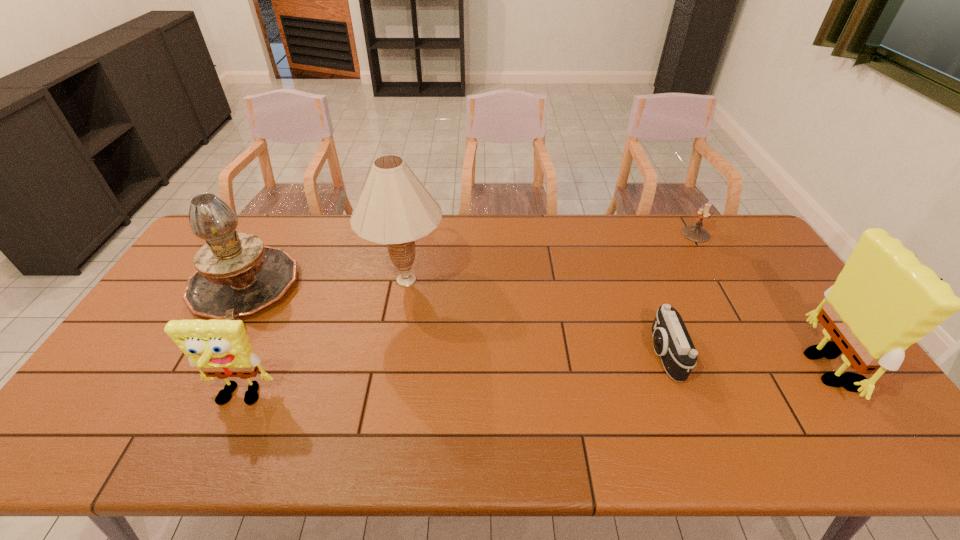
Where is `object situated at the left edge`? The image size is (960, 540). object situated at the left edge is located at coordinates (237, 275).

Where is `sponge situated at the right edge`? sponge situated at the right edge is located at coordinates (884, 300).

Where is `candle holder located in the right edge section of the desktop`? The image size is (960, 540). candle holder located in the right edge section of the desktop is located at coordinates (694, 233).

Where is `object that is at the far left corner`? The image size is (960, 540). object that is at the far left corner is located at coordinates (237, 275).

The width and height of the screenshot is (960, 540). I want to click on object at the far right corner, so click(694, 233).

Locate an element on the screen. The image size is (960, 540). object present at the near right corner is located at coordinates (884, 300).

Find the location of `vacant space at the far edge`. vacant space at the far edge is located at coordinates (347, 241).

At what (x,y) coordinates should I click in order to perform the action: click on vacant space at the near edge. Please return your answer as a coordinate pair (x, y). The width and height of the screenshot is (960, 540). Looking at the image, I should click on (598, 397).

This screenshot has width=960, height=540. Identify the location of blank area at the left edge. (180, 313).

Image resolution: width=960 pixels, height=540 pixels. Identify the location of vacant area at the right edge. (766, 322).